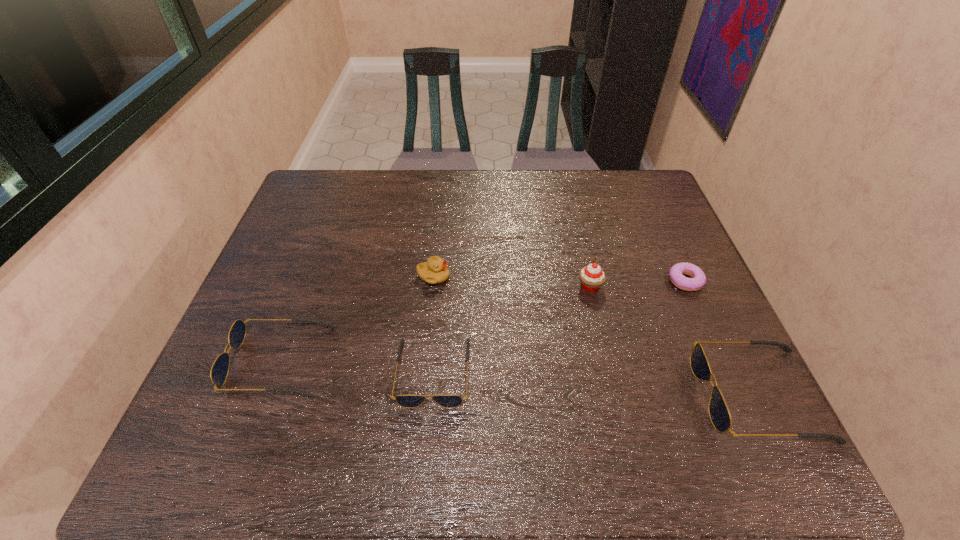
Locate an element on the screen. free location that satisfies the following two spatial constraints: 1. on the front-facing side of the duckling; 2. on the back side of the doughnut is located at coordinates (433, 281).

The height and width of the screenshot is (540, 960). I want to click on free point that satisfies the following two spatial constraints: 1. on the back side of the tallest object; 2. on the front-facing side of the duckling, so click(588, 276).

Locate an element on the screen. free location that satisfies the following two spatial constraints: 1. on the front-facing side of the duckling; 2. on the back side of the tallest object is located at coordinates (433, 286).